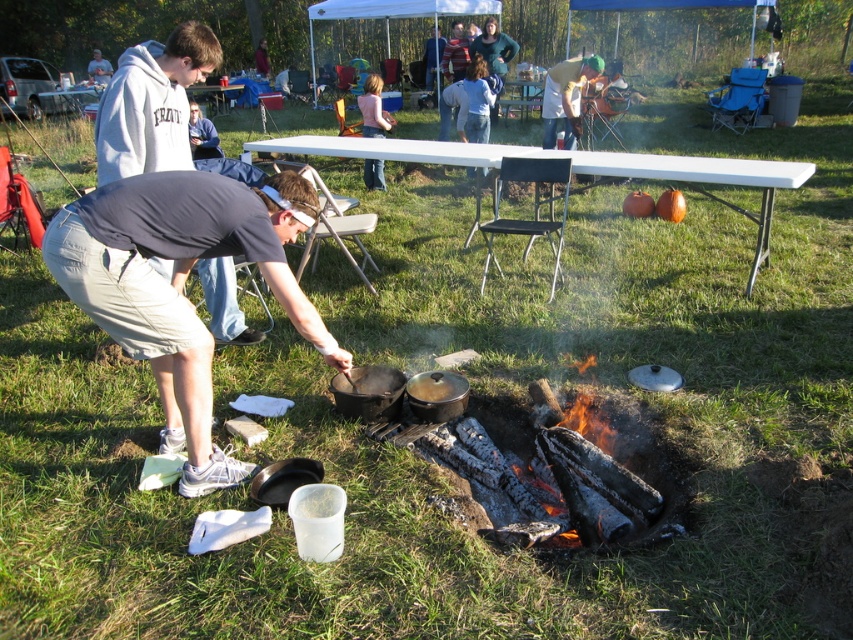
Question: Is gray cotton shirt at center smaller than white plastic picnic table at upper center?

Choices:
 (A) no
 (B) yes

Answer: (B)

Question: Among these objects, which one is nearest to the camera?

Choices:
 (A) pink fabric shirt at center
 (B) gray cotton shirt at center

Answer: (B)

Question: Which point appears closest to the camera in this image?

Choices:
 (A) (157, 212)
 (B) (363, 166)
 (C) (370, 145)

Answer: (A)

Question: Does gray cotton shirt at center come behind white plastic picnic table at upper center?

Choices:
 (A) yes
 (B) no

Answer: (B)

Question: Does gray cotton shirt at center lie behind pink fabric shirt at center?

Choices:
 (A) no
 (B) yes

Answer: (A)

Question: Which point is closer to the camera?

Choices:
 (A) (384, 147)
 (B) (137, 246)

Answer: (B)